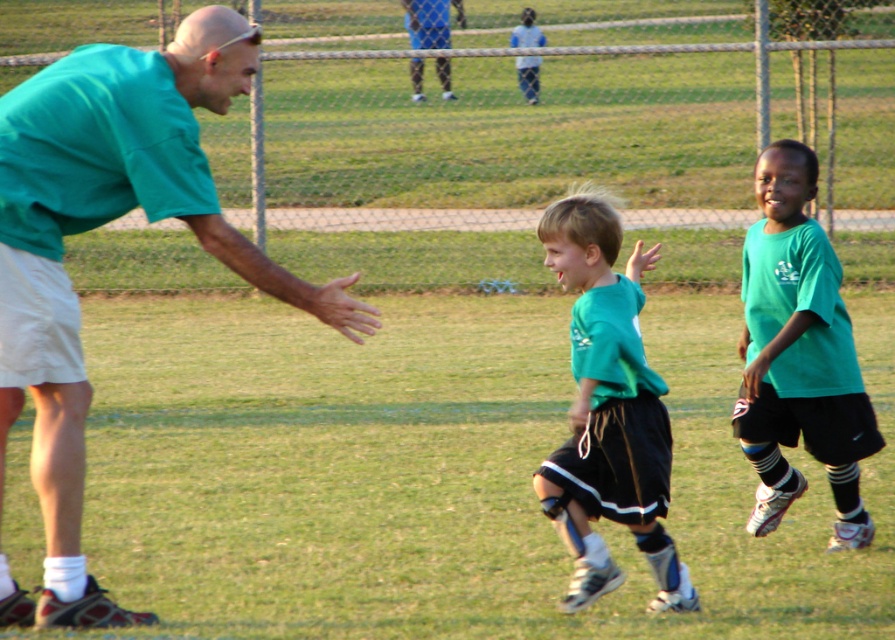
Question: Which point is closer to the camera taking this photo?

Choices:
 (A) (609, 304)
 (B) (761, 387)
 (C) (67, 451)

Answer: (A)

Question: Which is nearer to the green matte shirt at right?

Choices:
 (A) green matte shirt at center
 (B) green matte shirt at left
 (C) blue jersey at upper center

Answer: (A)

Question: Which of the following is the closest to the observer?

Choices:
 (A) green matte shirt at right
 (B) blue jersey at upper center
 (C) green matte shirt at center
 (D) green matte shirt at left

Answer: (D)

Question: Does green matte shirt at center appear over green matte shirt at right?

Choices:
 (A) no
 (B) yes

Answer: (A)

Question: Is green matte shirt at center to the right of blue jersey at upper center from the viewer's perspective?

Choices:
 (A) no
 (B) yes

Answer: (B)

Question: Is the position of green matte shirt at left less distant than that of green matte shirt at right?

Choices:
 (A) no
 (B) yes

Answer: (B)